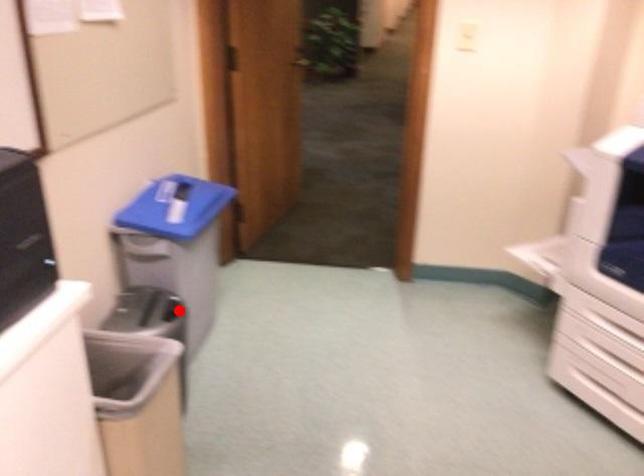
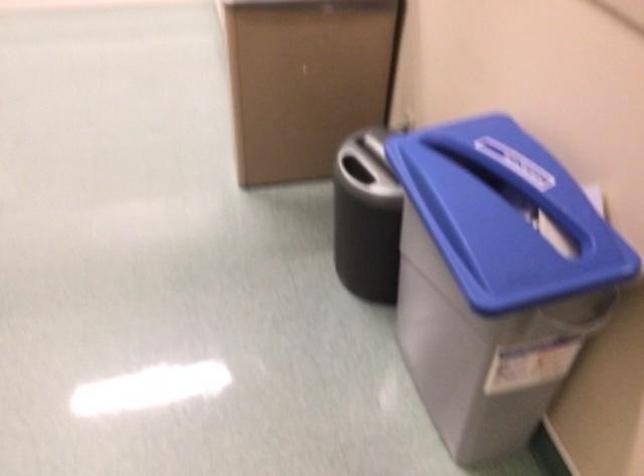
Question: I am providing you with two images of the same scene from different viewpoints. Given a red point in image1, look at the same physical point in image2. Is it:

Choices:
 (A) Closer to the viewpoint
 (B) Farther from the viewpoint

Answer: (A)